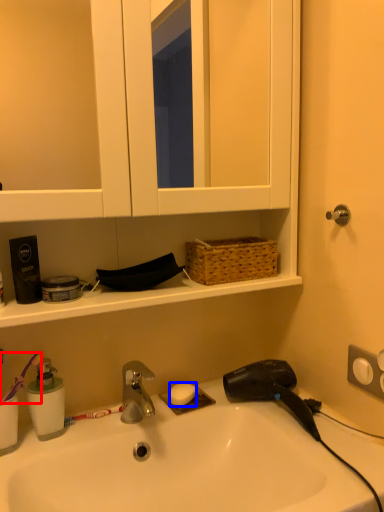
Question: Which of the following is the closest to the observer, brush (highlighted by a red box) or soap (highlighted by a blue box)?

Choices:
 (A) brush
 (B) soap

Answer: (A)